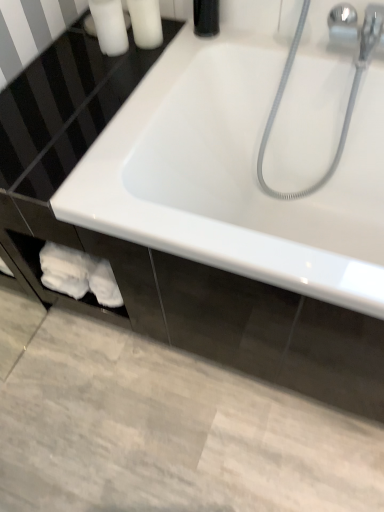
Question: From a real-world perspective, is white matte soap at upper left, which ranks as the first toiletry in left-to-right order, positioned above or below white matte bottle at upper left, placed as the first toiletry when sorted from right to left?

Choices:
 (A) below
 (B) above

Answer: (A)

Question: In terms of height, does white matte soap at upper left, arranged as the 2th toiletry when viewed from the right, look taller or shorter compared to white matte bottle at upper left, arranged as the 2th toiletry when viewed from the left?

Choices:
 (A) short
 (B) tall

Answer: (B)

Question: Which object is positioned closest to the white glossy bathtub at center?

Choices:
 (A) white matte bottle at upper left, placed as the first toiletry when sorted from right to left
 (B) white matte soap at upper left, which ranks as the first toiletry in left-to-right order

Answer: (A)

Question: Considering the real-world distances, which object is farthest from the white matte bottle at upper left, placed as the first toiletry when sorted from right to left?

Choices:
 (A) white glossy bathtub at center
 (B) white matte soap at upper left, which ranks as the first toiletry in left-to-right order

Answer: (A)